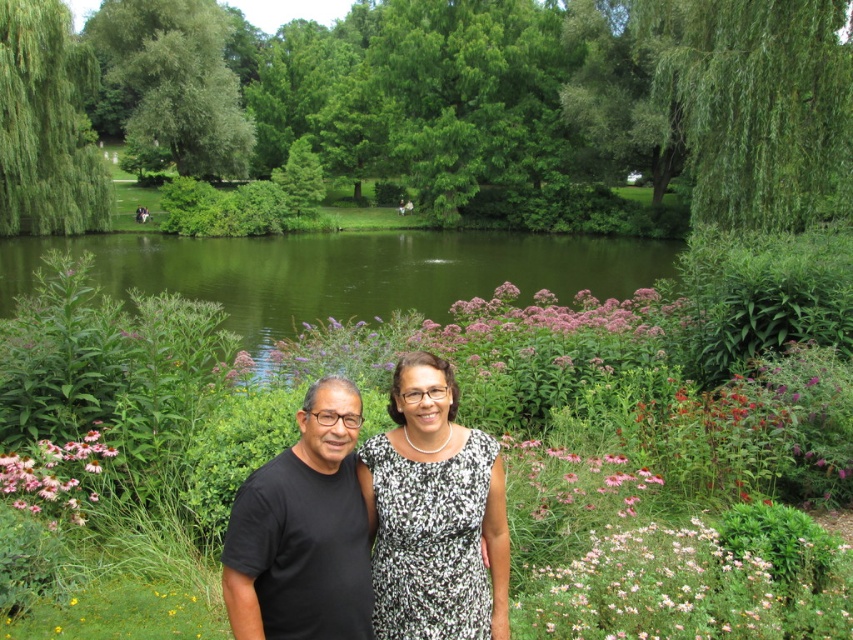
Question: Can you confirm if black matte t-shirt at center is positioned below pink matte flower at center?

Choices:
 (A) no
 (B) yes

Answer: (A)

Question: Where is black printed dress at center located in relation to pink matte flower at center in the image?

Choices:
 (A) above
 (B) below

Answer: (A)

Question: Can you confirm if green smooth water at center is thinner than pink matte flower at lower center?

Choices:
 (A) no
 (B) yes

Answer: (A)

Question: Which point is farther to the camera?

Choices:
 (A) black matte t-shirt at center
 (B) black printed dress at center

Answer: (B)

Question: Considering the real-world distances, which object is closest to the black matte t-shirt at center?

Choices:
 (A) pink matte flower at center
 (B) green smooth water at center
 (C) black printed dress at center

Answer: (C)

Question: Among these objects, which one is farthest from the camera?

Choices:
 (A) black matte t-shirt at center
 (B) green smooth water at center

Answer: (B)